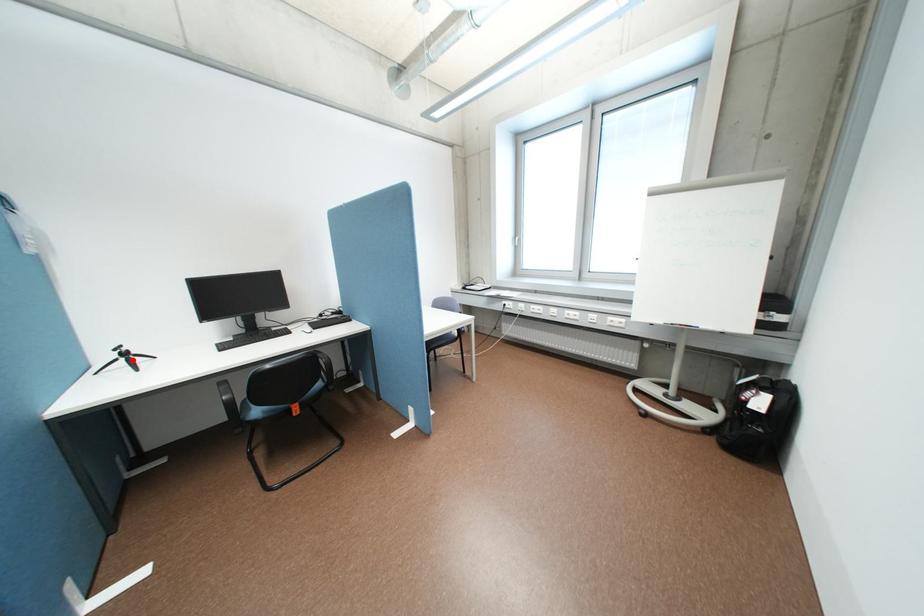
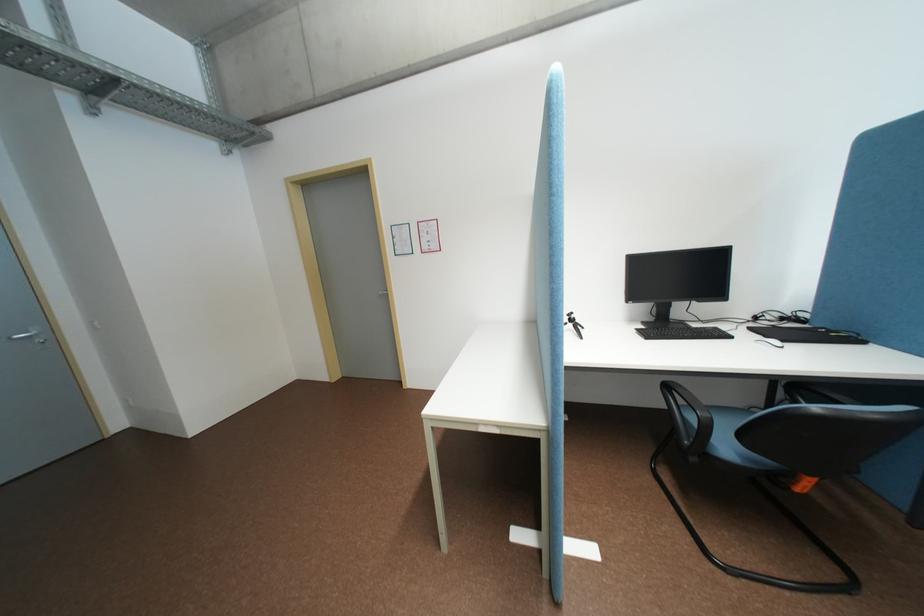
Question: I am providing you with two images of the same scene from different viewpoints. In image1, a red point is highlighted. Considering the same 3D point in image2, which of the following is correct?

Choices:
 (A) It is closer
 (B) It is farther

Answer: (B)